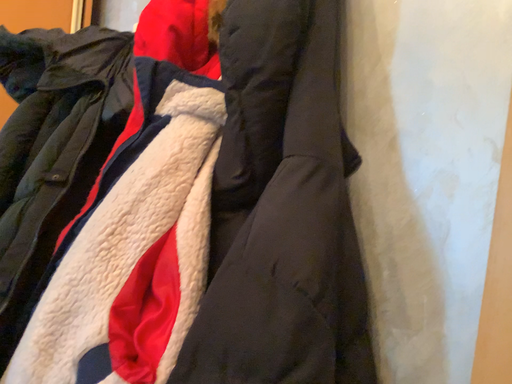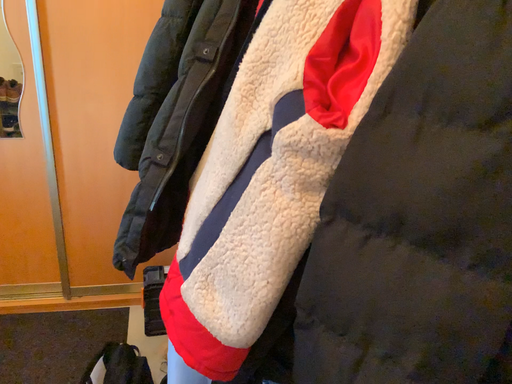
Question: How did the camera likely rotate when shooting the video?

Choices:
 (A) rotated right
 (B) rotated left

Answer: (B)